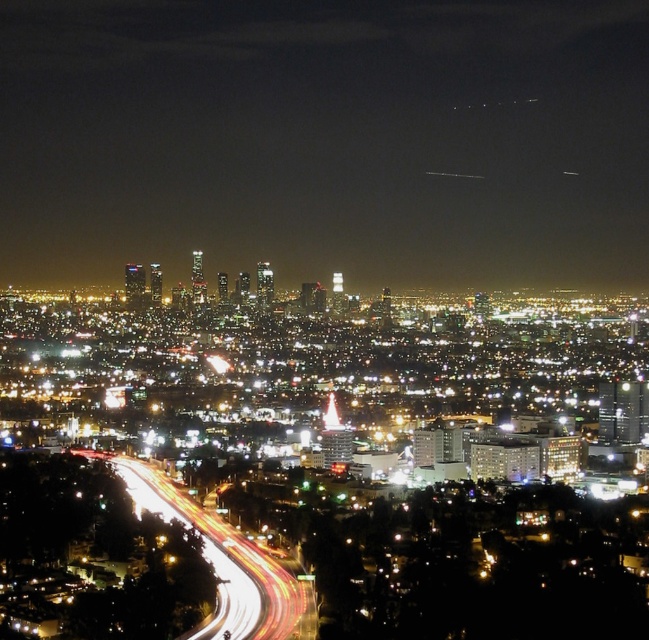
Question: Is glittering glass skyscrapers at center positioned in front of white light trails at lower left?

Choices:
 (A) no
 (B) yes

Answer: (B)

Question: Is glittering glass skyscrapers at center to the left of white light trails at lower left from the viewer's perspective?

Choices:
 (A) no
 (B) yes

Answer: (A)

Question: Is the position of glittering glass skyscrapers at center less distant than that of white light trails at lower left?

Choices:
 (A) no
 (B) yes

Answer: (B)